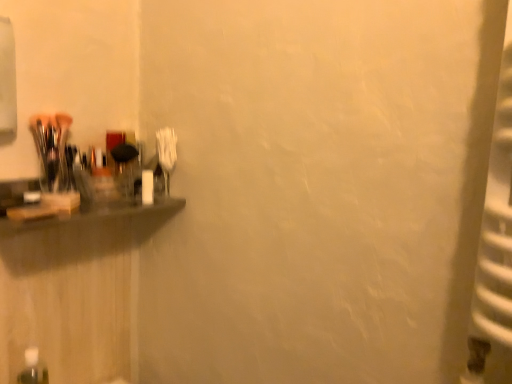
Question: From their relative heights in the image, would you say transparent plastic bottle at lower left is taller or shorter than matte black shelf at left?

Choices:
 (A) tall
 (B) short

Answer: (A)

Question: Considering the positions of transparent plastic bottle at lower left and matte black shelf at left in the image, is transparent plastic bottle at lower left bigger or smaller than matte black shelf at left?

Choices:
 (A) small
 (B) big

Answer: (A)

Question: Visually, is transparent plastic bottle at lower left positioned to the left or to the right of matte black shelf at left?

Choices:
 (A) right
 (B) left

Answer: (B)

Question: Is matte black shelf at left spatially inside transparent plastic bottle at lower left, or outside of it?

Choices:
 (A) inside
 (B) outside

Answer: (B)

Question: Is point (184, 201) positioned closer to the camera than point (29, 382)?

Choices:
 (A) farther
 (B) closer

Answer: (A)

Question: Is matte black shelf at left taller or shorter than transparent plastic bottle at lower left?

Choices:
 (A) tall
 (B) short

Answer: (B)

Question: Looking at the image, does matte black shelf at left seem bigger or smaller compared to transparent plastic bottle at lower left?

Choices:
 (A) small
 (B) big

Answer: (B)